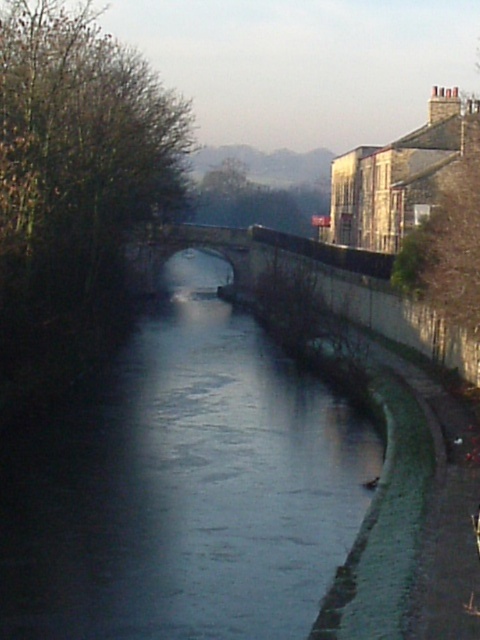
Question: Which of the following is the closest to the observer?

Choices:
 (A) (145, 294)
 (B) (202, 554)

Answer: (B)

Question: Is smooth concrete river at center to the left of stone arch bridge at center from the viewer's perspective?

Choices:
 (A) no
 (B) yes

Answer: (A)

Question: Is smooth concrete river at center in front of stone arch bridge at center?

Choices:
 (A) no
 (B) yes

Answer: (B)

Question: Which object is closer to the camera taking this photo?

Choices:
 (A) smooth concrete river at center
 (B) stone arch bridge at center

Answer: (A)

Question: Does smooth concrete river at center have a smaller size compared to stone arch bridge at center?

Choices:
 (A) no
 (B) yes

Answer: (B)